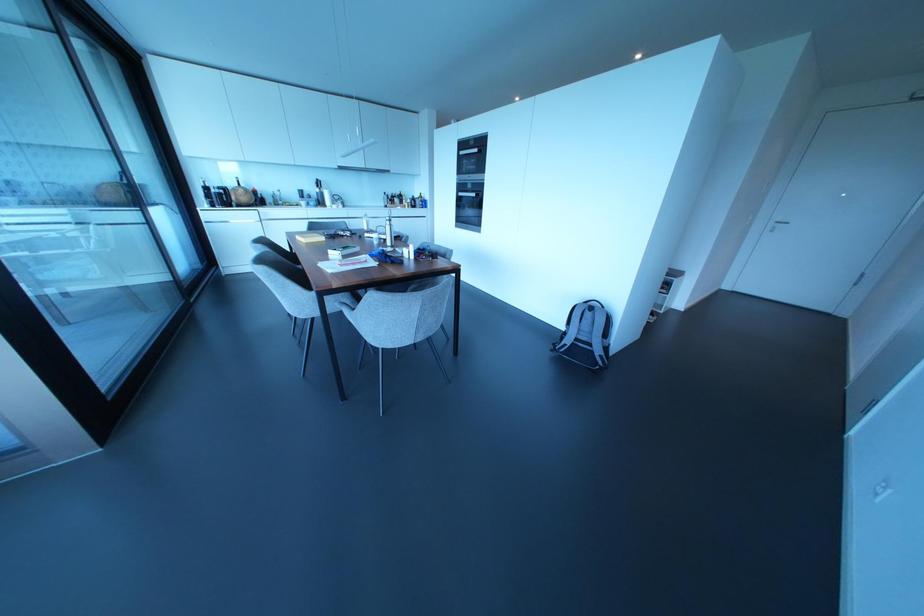
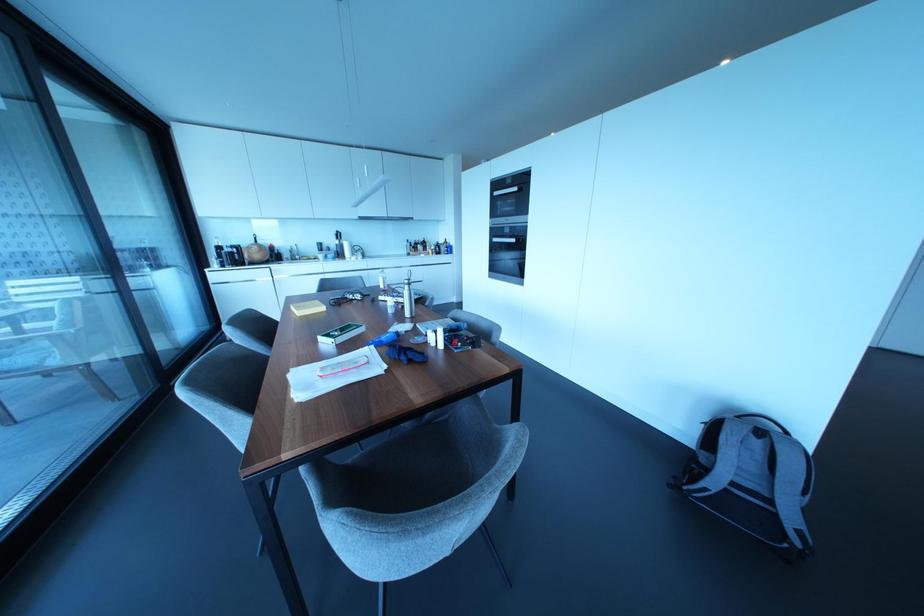
Where in the second image is the point corresponding to the point at 347,233 from the first image?

(358, 296)